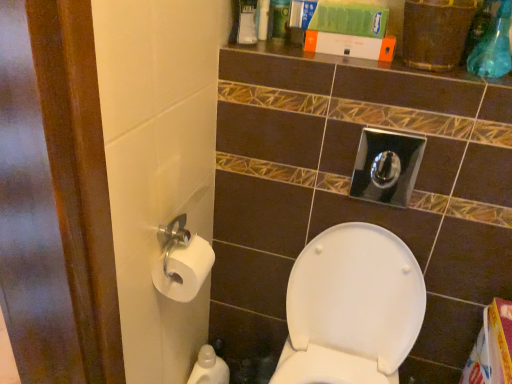
Question: Should I look upward or downward to see white glossy toilet seat at center?

Choices:
 (A) up
 (B) down

Answer: (B)

Question: Which direction should I rotate to look at white plastic container at upper center, which ranks as the first toiletry in right-to-left order?

Choices:
 (A) left
 (B) right

Answer: (B)

Question: Considering the relative positions of white paper at left, the 2th toiletry positioned from the top, and white plastic container at upper center, acting as the 2th toiletry starting from the left, in the image provided, is white paper at left, the 2th toiletry positioned from the top, to the left of white plastic container at upper center, acting as the 2th toiletry starting from the left, from the viewer's perspective?

Choices:
 (A) yes
 (B) no

Answer: (A)

Question: Can you confirm if white paper at left, positioned as the second toiletry in right-to-left order, is thinner than white plastic container at upper center, which ranks as the 2th toiletry in front-to-back order?

Choices:
 (A) yes
 (B) no

Answer: (B)

Question: Is white paper at left, the 2th toiletry positioned from the top, positioned far away from white plastic container at upper center, which ranks as the 2th toiletry in front-to-back order?

Choices:
 (A) no
 (B) yes

Answer: (A)

Question: Is white paper at left, which ranks as the 1th toiletry in front-to-back order, completely or partially outside of white plastic container at upper center, acting as the 2th toiletry starting from the left?

Choices:
 (A) no
 (B) yes

Answer: (B)

Question: Is white paper at left, which is the second toiletry in back-to-front order, bigger than white plastic container at upper center, which ranks as the first toiletry in right-to-left order?

Choices:
 (A) yes
 (B) no

Answer: (A)

Question: Can you confirm if white paper at left, which is the first toiletry in bottom-to-top order, is smaller than white plastic container at upper center, which ranks as the 2th toiletry in front-to-back order?

Choices:
 (A) yes
 (B) no

Answer: (B)

Question: Is white glossy plastic bottle at lower left not inside white paper at left, the first toiletry positioned from the left?

Choices:
 (A) yes
 (B) no

Answer: (A)

Question: Considering the relative sizes of white glossy plastic bottle at lower left and white paper at left, the 2th toiletry positioned from the top, in the image provided, is white glossy plastic bottle at lower left shorter than white paper at left, the 2th toiletry positioned from the top,?

Choices:
 (A) no
 (B) yes

Answer: (A)

Question: Does white glossy plastic bottle at lower left have a lesser width compared to white paper at left, the 2th toiletry positioned from the top?

Choices:
 (A) no
 (B) yes

Answer: (A)

Question: Is white paper at left, positioned as the second toiletry in right-to-left order, inside white glossy plastic bottle at lower left?

Choices:
 (A) yes
 (B) no

Answer: (B)

Question: From a real-world perspective, does white glossy plastic bottle at lower left sit lower than white paper at left, which is the second toiletry in back-to-front order?

Choices:
 (A) yes
 (B) no

Answer: (A)

Question: From the image's perspective, would you say white glossy plastic bottle at lower left is positioned over white paper at left, which is the second toiletry in back-to-front order?

Choices:
 (A) yes
 (B) no

Answer: (B)

Question: Considering the relative sizes of white glossy plastic bottle at lower left and white plastic container at upper center, which ranks as the 2th toiletry in front-to-back order, in the image provided, is white glossy plastic bottle at lower left wider than white plastic container at upper center, which ranks as the 2th toiletry in front-to-back order,?

Choices:
 (A) no
 (B) yes

Answer: (B)